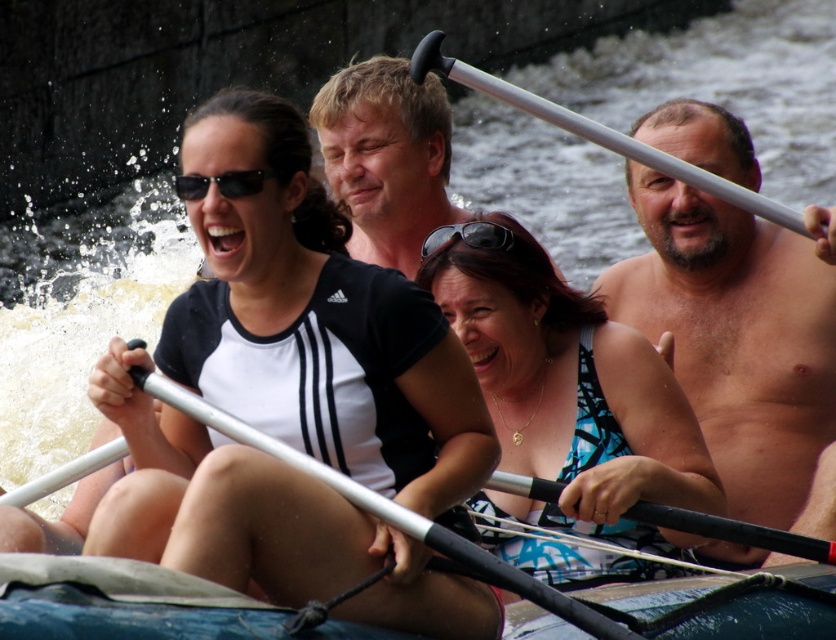
Does shiny silver paddle at center have a larger size compared to silver metallic paddle at center?

Indeed, shiny silver paddle at center has a larger size compared to silver metallic paddle at center.

Is point (686, 120) less distant than point (539, 595)?

No, (686, 120) is behind (539, 595).

At what (x,y) coordinates should I click in order to perform the action: click on shiny silver paddle at center. Please return your answer as a coordinate pair (x, y). Looking at the image, I should click on (742, 340).

Does silver metallic paddle at center appear over black matte sunglasses at upper left?

No.

Can you confirm if silver metallic paddle at center is positioned to the right of black matte sunglasses at upper left?

Yes, silver metallic paddle at center is to the right of black matte sunglasses at upper left.

Is point (144, 348) in front of point (190, 184)?

Yes.

Image resolution: width=836 pixels, height=640 pixels. In order to click on silver metallic paddle at center in this screenshot , I will do `click(386, 509)`.

Does blue printed swimsuit at center have a larger size compared to silver metallic paddle at upper right?

No.

Between blue printed swimsuit at center and silver metallic paddle at upper right, which one has more height?

silver metallic paddle at upper right

Between point (717, 497) and point (455, 74), which one is positioned in front?

Point (455, 74) is more forward.

At what (x,y) coordinates should I click in order to perform the action: click on blue printed swimsuit at center. Please return your answer as a coordinate pair (x, y). The width and height of the screenshot is (836, 640). Looking at the image, I should click on (569, 412).